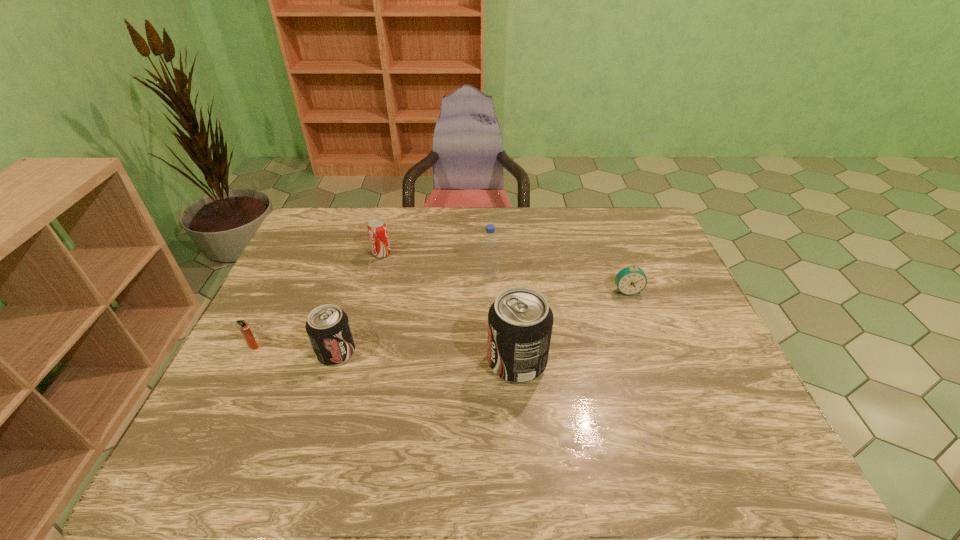
Image resolution: width=960 pixels, height=540 pixels. Identify the location of the tallest soda can. (520, 321).

Identify the location of the fifth nearest object. This screenshot has width=960, height=540. (490, 243).

At what (x,y) coordinates should I click in order to perform the action: click on the third farthest object. Please return your answer as a coordinate pair (x, y). Image resolution: width=960 pixels, height=540 pixels. Looking at the image, I should click on (631, 280).

You are a GUI agent. You are given a task and a screenshot of the screen. Output one action in this format:
    pyautogui.click(x=<x>, y=<y>)
    Task: Click on the alarm clock
    This screenshot has width=960, height=540.
    Given the screenshot: What is the action you would take?
    pyautogui.click(x=631, y=280)

Locate an element on the screen. This screenshot has height=540, width=960. the farthest soda can is located at coordinates (377, 231).

Where is `igniter`? Image resolution: width=960 pixels, height=540 pixels. igniter is located at coordinates (243, 326).

Identify the location of blank space located on the back of the rightmost soda can. The height and width of the screenshot is (540, 960). (512, 292).

Identify the location of free region located 0.140m on the back of the bottle. (489, 244).

Identify the location of free space located 0.290m on the front-facing side of the fourth nearest object. (660, 381).

Identify the location of vacant region located on the logo side of the farthest object. (428, 253).